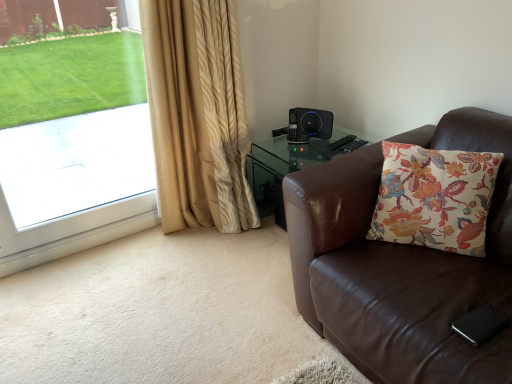
The height and width of the screenshot is (384, 512). Describe the element at coordinates (309, 124) in the screenshot. I see `black plastic speaker at upper right` at that location.

Where is `brown leather chair at right`? The width and height of the screenshot is (512, 384). brown leather chair at right is located at coordinates (401, 265).

Describe the element at coordinates (73, 137) in the screenshot. Image resolution: width=512 pixels, height=384 pixels. I see `white glass window at left` at that location.

You are a GUI agent. You are given a task and a screenshot of the screen. Output one action in this format:
    pyautogui.click(x=<x>, y=<y>)
    Task: Click on the black plastic speaker at upper right
    
    Given the screenshot: What is the action you would take?
    pyautogui.click(x=309, y=124)

Between floral fabric cushion at right and white glass window at left, which one appears on the left side from the viewer's perspective?

white glass window at left is more to the left.

Considering the sizes of floral fabric cushion at right and white glass window at left in the image, is floral fabric cushion at right bigger or smaller than white glass window at left?

Clearly, floral fabric cushion at right is smaller in size than white glass window at left.

From a real-world perspective, is floral fabric cushion at right positioned under white glass window at left based on gravity?

Correct, in the physical world, floral fabric cushion at right is lower than white glass window at left.

Between point (424, 180) and point (70, 152), which one is positioned in front?

The point (424, 180) is closer to the camera.

From a real-world perspective, is black plastic speaker at upper right under brown leather chair at right?

No, from a real-world perspective, black plastic speaker at upper right is not below brown leather chair at right.

Considering the relative sizes of black plastic speaker at upper right and brown leather chair at right in the image provided, is black plastic speaker at upper right shorter than brown leather chair at right?

Yes.

From the image's perspective, is black plastic speaker at upper right below brown leather chair at right?

Incorrect, from the image's perspective, black plastic speaker at upper right is higher than brown leather chair at right.

Considering the positions of objects white glass window at left and black plastic speaker at upper right in the image provided, who is more to the right, white glass window at left or black plastic speaker at upper right?

Positioned to the right is black plastic speaker at upper right.

From a real-world perspective, is white glass window at left on top of black plastic speaker at upper right?

Yes, from a real-world perspective, white glass window at left is above black plastic speaker at upper right.

Considering the relative sizes of white glass window at left and black plastic speaker at upper right in the image provided, is white glass window at left shorter than black plastic speaker at upper right?

No, white glass window at left is not shorter than black plastic speaker at upper right.

From the picture: How distant is white glass window at left from black plastic speaker at upper right?

white glass window at left and black plastic speaker at upper right are 6.43 feet apart.

Considering the relative sizes of white glass window at left and beige textured curtain at left in the image provided, is white glass window at left shorter than beige textured curtain at left?

Yes.

Find the location of `window screen on the left of beige textured curtain at left`. window screen on the left of beige textured curtain at left is located at coordinates (73, 137).

Do you think white glass window at left is within beige textured curtain at left, or outside of it?

The correct answer is: outside.

Does white glass window at left lie in front of beige textured curtain at left?

Yes, white glass window at left is closer to the camera.

Which object is closer to the camera, beige textured curtain at left or floral fabric cushion at right?

Positioned in front is floral fabric cushion at right.

Considering the positions of point (207, 70) and point (439, 199), is point (207, 70) closer or farther from the camera than point (439, 199)?

Clearly, point (207, 70) is more distant from the camera than point (439, 199).

Would you say beige textured curtain at left is to the left or to the right of floral fabric cushion at right in the picture?

beige textured curtain at left is positioned on floral fabric cushion at right's left side.

Between beige textured curtain at left and floral fabric cushion at right, which one has smaller size?

Smaller between the two is floral fabric cushion at right.

Is black plastic speaker at upper right at the back of floral fabric cushion at right?

floral fabric cushion at right does not have its back to black plastic speaker at upper right.

From the image's perspective, between floral fabric cushion at right and black plastic speaker at upper right, who is located below?

floral fabric cushion at right, from the image's perspective.

In the scene shown: Considering the relative sizes of floral fabric cushion at right and black plastic speaker at upper right in the image provided, is floral fabric cushion at right wider than black plastic speaker at upper right?

Yes.

Based on the photo, is brown leather chair at right inside beige textured curtain at left?

Actually, brown leather chair at right is outside beige textured curtain at left.

Relative to brown leather chair at right, is beige textured curtain at left in front or behind?

In the image, beige textured curtain at left appears behind brown leather chair at right.

From the image's perspective, relative to brown leather chair at right, is beige textured curtain at left above or below?

From the image's perspective, beige textured curtain at left appears above brown leather chair at right.

This screenshot has width=512, height=384. Identify the location of pillow on the right side of white glass window at left. (434, 198).

The height and width of the screenshot is (384, 512). Identify the location of speaker behind the brown leather chair at right. click(309, 124).

Estimate the real-world distances between objects in this image. Which object is closer to floral fabric cushion at right, brown leather chair at right or black plastic speaker at upper right?

The object closer to floral fabric cushion at right is brown leather chair at right.

When comparing their distances from beige textured curtain at left, does brown leather chair at right or white glass window at left seem further?

white glass window at left.

Based on their spatial positions, is beige textured curtain at left or white glass window at left further from black plastic speaker at upper right?

The object further to black plastic speaker at upper right is white glass window at left.

Based on their spatial positions, is beige textured curtain at left or brown leather chair at right further from floral fabric cushion at right?

beige textured curtain at left is positioned further to the anchor floral fabric cushion at right.

Which object lies nearer to the anchor point floral fabric cushion at right, white glass window at left or brown leather chair at right?

brown leather chair at right is positioned closer to the anchor floral fabric cushion at right.

Considering their positions, is floral fabric cushion at right positioned further to black plastic speaker at upper right than beige textured curtain at left?

Based on the image, floral fabric cushion at right appears to be further to black plastic speaker at upper right.

Looking at the image, which one is located closer to beige textured curtain at left, white glass window at left or brown leather chair at right?

The object closer to beige textured curtain at left is brown leather chair at right.

When comparing their distances from white glass window at left, does black plastic speaker at upper right or floral fabric cushion at right seem further?

Among the two, floral fabric cushion at right is located further to white glass window at left.

This screenshot has height=384, width=512. In order to click on speaker situated between white glass window at left and floral fabric cushion at right from left to right in this screenshot , I will do `click(309, 124)`.

At what (x,y) coordinates should I click in order to perform the action: click on curtain between brown leather chair at right and black plastic speaker at upper right in the front-back direction. Please return your answer as a coordinate pair (x, y). Looking at the image, I should click on (197, 114).

The image size is (512, 384). I want to click on curtain between floral fabric cushion at right and black plastic speaker at upper right from front to back, so click(x=197, y=114).

Where is `pillow between white glass window at left and brown leather chair at right in the horizontal direction`? The image size is (512, 384). pillow between white glass window at left and brown leather chair at right in the horizontal direction is located at coordinates (434, 198).